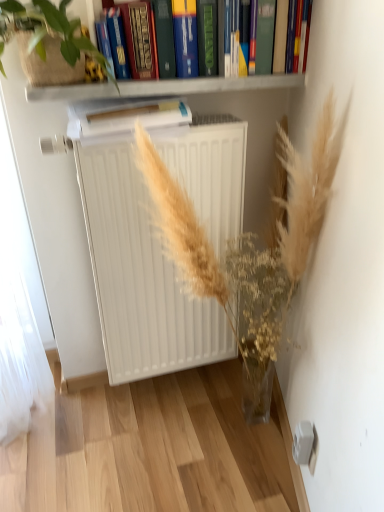
Question: Considering the positions of white matte shelf at upper center and hardcover book at upper center in the image, is white matte shelf at upper center bigger or smaller than hardcover book at upper center?

Choices:
 (A) small
 (B) big

Answer: (A)

Question: Is white matte shelf at upper center wider or thinner than hardcover book at upper center?

Choices:
 (A) wide
 (B) thin

Answer: (A)

Question: Which object is positioned closest to the white matte radiator at center?

Choices:
 (A) hardcover book at upper center
 (B) white matte shelf at upper center
 (C) green leafy plant at upper left
 (D) white paper at center, which appears as the 2th paperback book when viewed from the top
 (E) translucent glass vase at center

Answer: (E)

Question: Which object is positioned closest to the hardcover book at upper center?

Choices:
 (A) green leafy plant at upper left
 (B) white matte radiator at center
 (C) hardcover book at upper center, the 2th paperback book from the bottom
 (D) white paper at center, which appears as the 2th paperback book when viewed from the top
 (E) translucent glass vase at center

Answer: (D)